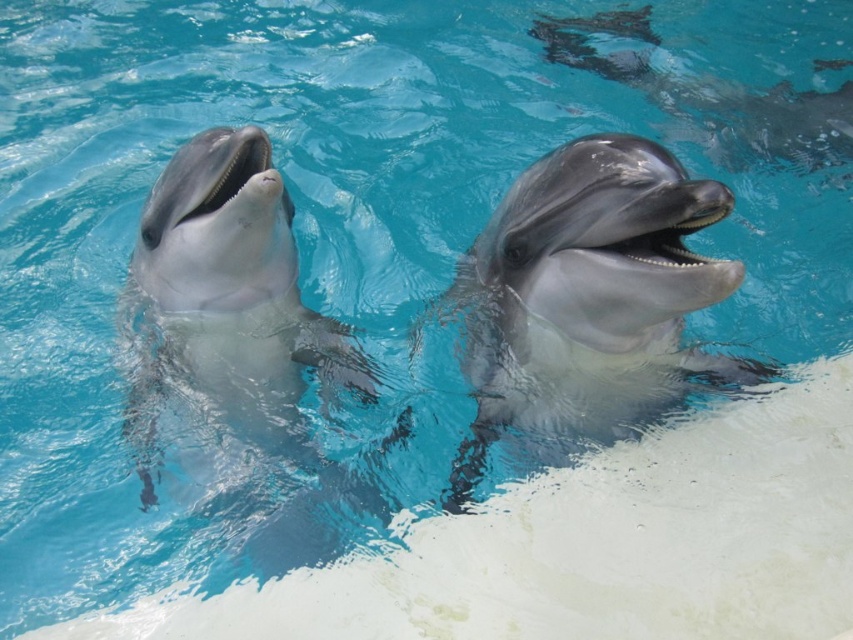
Between point (612, 339) and point (550, 33), which one is positioned behind?

The point (550, 33) is more distant.

What do you see at coordinates (589, 298) in the screenshot? I see `sleek gray dolphin at center` at bounding box center [589, 298].

At what (x,y) coordinates should I click in order to perform the action: click on sleek gray dolphin at center. Please return your answer as a coordinate pair (x, y). Looking at the image, I should click on (589, 298).

Which of these two, sleek gray dolphin at center or smooth gray dolphin at center, stands shorter?

sleek gray dolphin at center

Between point (635, 179) and point (209, 392), which one is positioned in front?

Positioned in front is point (635, 179).

You are a GUI agent. You are given a task and a screenshot of the screen. Output one action in this format:
    pyautogui.click(x=<x>, y=<y>)
    Task: Click on the sleek gray dolphin at center
    The height and width of the screenshot is (640, 853).
    Given the screenshot: What is the action you would take?
    pyautogui.click(x=589, y=298)

Does smooth gray dolphin at center have a lesser width compared to glossy gray dolphin at upper right?

Yes.

Image resolution: width=853 pixels, height=640 pixels. What do you see at coordinates (233, 308) in the screenshot?
I see `smooth gray dolphin at center` at bounding box center [233, 308].

The height and width of the screenshot is (640, 853). Identify the location of smooth gray dolphin at center. (233, 308).